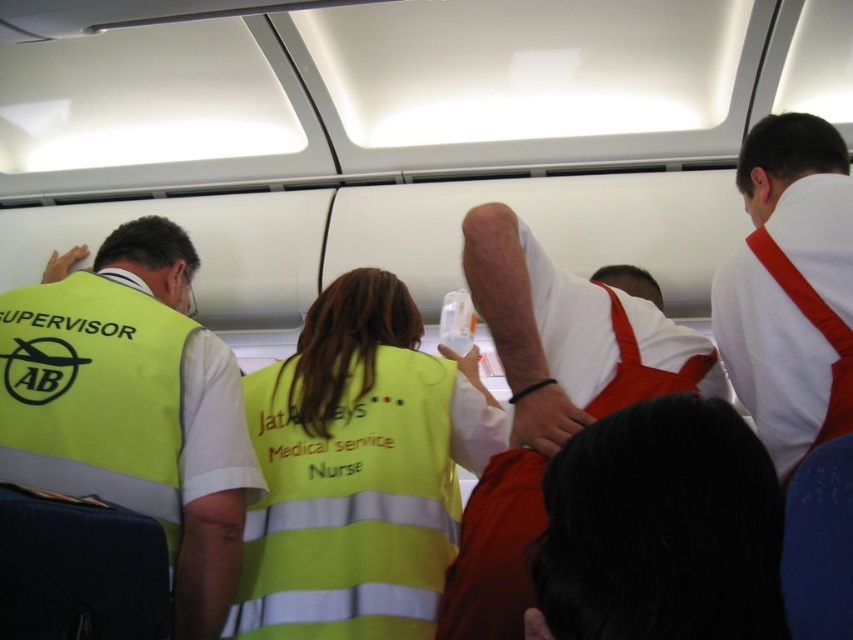
Does high visibility yellow vest at center appear under white cotton shirt at upper center?

Correct, high visibility yellow vest at center is located below white cotton shirt at upper center.

Between high visibility yellow vest at center and white cotton shirt at upper center, which one has more height?

With more height is white cotton shirt at upper center.

This screenshot has height=640, width=853. Find the location of `high visibility yellow vest at center`. high visibility yellow vest at center is located at coordinates (357, 472).

Locate an element on the screen. The image size is (853, 640). high visibility yellow vest at center is located at coordinates (357, 472).

Between white cotton shirt at upper center and white cotton shirt at upper right, which one has more height?

white cotton shirt at upper right is taller.

Who is lower down, white cotton shirt at upper center or white cotton shirt at upper right?

white cotton shirt at upper center is below.

Who is more forward, (485, 518) or (780, 356)?

Point (485, 518)

Identify the location of white cotton shirt at upper center. (549, 400).

Looking at this image, does yellow reflective vest at left appear under white cotton shirt at upper center?

Yes.

What do you see at coordinates (132, 404) in the screenshot? I see `yellow reflective vest at left` at bounding box center [132, 404].

Identify the location of yellow reflective vest at left. The image size is (853, 640). (132, 404).